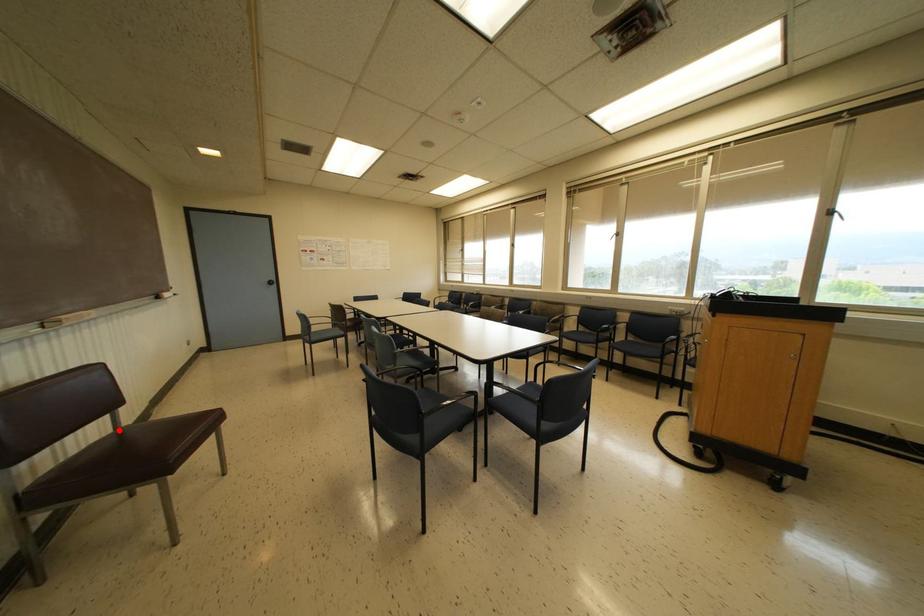
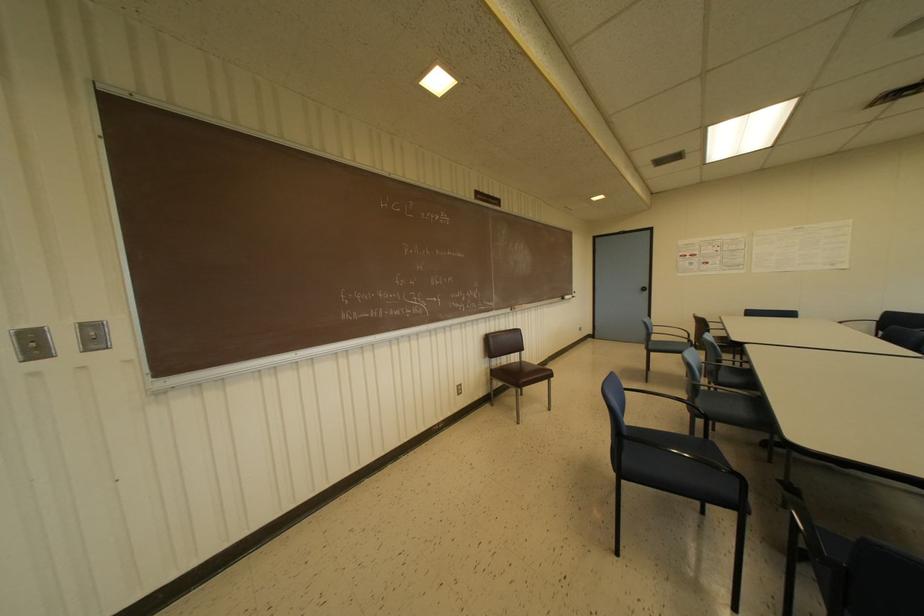
Question: A red point is marked in image1. In image2, is the corresponding 3D point closer to the camera or farther? Reply with the corresponding letter.

Choices:
 (A) The corresponding 3D point is closer.
 (B) The corresponding 3D point is farther.

Answer: (B)